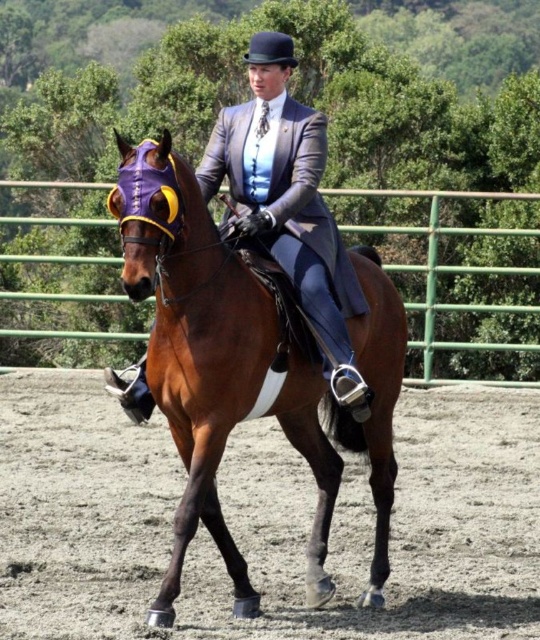
Does brown sandy dirt track at center have a lesser width compared to brown glossy horse at center?

Indeed, brown sandy dirt track at center has a lesser width compared to brown glossy horse at center.

How far apart are brown sandy dirt track at center and brown glossy horse at center?

A distance of 5.05 feet exists between brown sandy dirt track at center and brown glossy horse at center.

The image size is (540, 640). What are the coordinates of `brown sandy dirt track at center` in the screenshot? It's located at (266, 520).

How much distance is there between brown sandy dirt track at center and green metal fence at center?

They are 6.06 meters apart.

Between brown sandy dirt track at center and green metal fence at center, which one is positioned lower?

Positioned lower is brown sandy dirt track at center.

This screenshot has height=640, width=540. In order to click on brown sandy dirt track at center in this screenshot , I will do `click(266, 520)`.

Can you confirm if brown glossy horse at center is bigger than green metal fence at center?

Yes, brown glossy horse at center is bigger than green metal fence at center.

Is point (249, 582) in front of point (64, 294)?

That is True.

Between point (233, 577) and point (434, 257), which one is positioned behind?

The point (434, 257) is behind.

Find the location of a particular element. This screenshot has height=640, width=540. brown glossy horse at center is located at coordinates (246, 368).